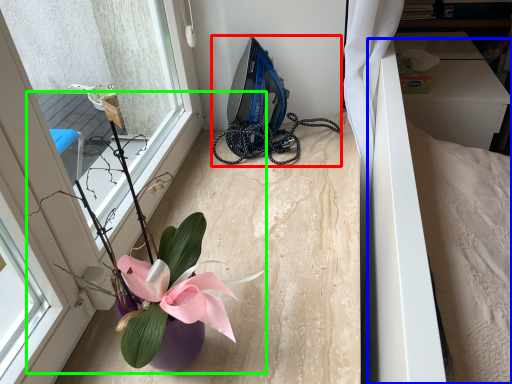
Question: Based on their relative distances, which object is farther from equipment (highlighted by a red box)? Choose from bed (highlighted by a blue box) and houseplant (highlighted by a green box).

Choices:
 (A) bed
 (B) houseplant

Answer: (B)